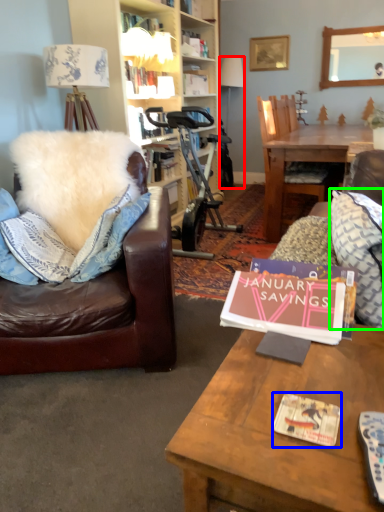
Question: Which object is positioned closest to lamp (highlighted by a red box)? Select from magazine (highlighted by a blue box) and pillow (highlighted by a green box).

Choices:
 (A) magazine
 (B) pillow

Answer: (B)